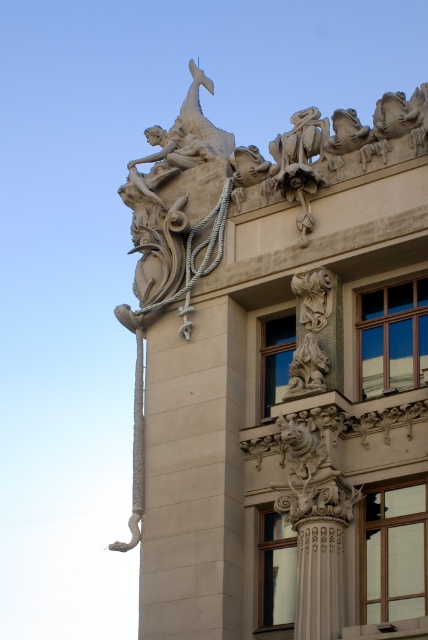
Question: Is beige stone column at center positioned in front of white stone column at center?

Choices:
 (A) no
 (B) yes

Answer: (A)

Question: Is beige stone column at center above white stone column at center?

Choices:
 (A) yes
 (B) no

Answer: (A)

Question: Where is beige stone column at center located in relation to white stone column at center in the image?

Choices:
 (A) right
 (B) left

Answer: (B)

Question: Which object is closer to the camera taking this photo?

Choices:
 (A) white stone column at center
 (B) beige stone column at center

Answer: (A)

Question: Which of the following is the closest to the observer?

Choices:
 (A) (321, 602)
 (B) (157, 614)

Answer: (A)